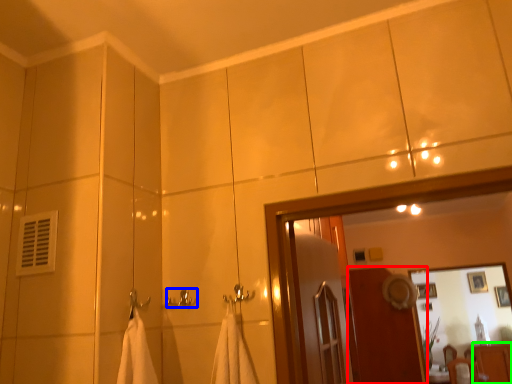
Question: Estimate the real-world distances between objects in this image. Which object is closer to screen door (highlighted by a red box), towel bar (highlighted by a blue box) or dresser (highlighted by a green box)?

Choices:
 (A) towel bar
 (B) dresser

Answer: (B)